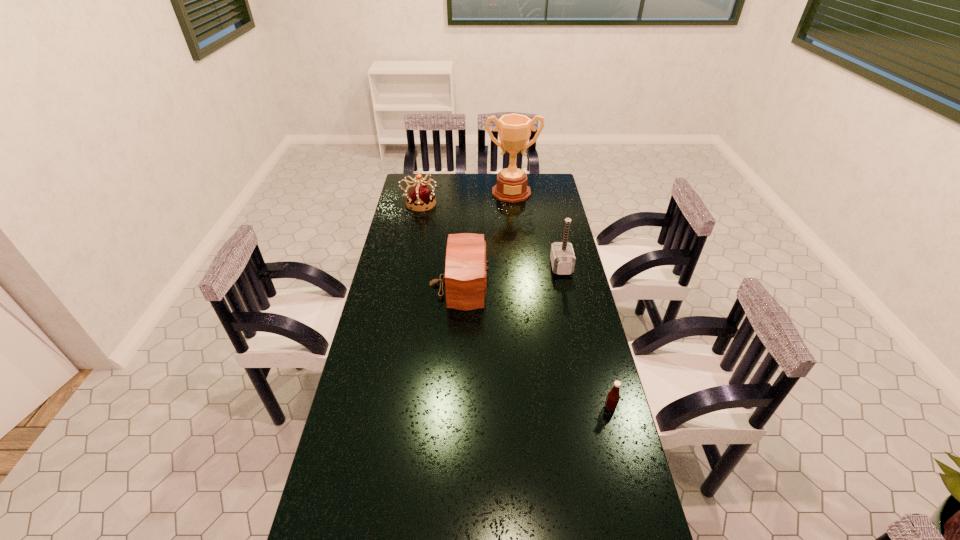
Where is `vacant region located on the front-facing side of the leftmost object`? Image resolution: width=960 pixels, height=540 pixels. vacant region located on the front-facing side of the leftmost object is located at coordinates (449, 204).

You are a GUI agent. You are given a task and a screenshot of the screen. Output one action in this format:
    pyautogui.click(x=<x>, y=<y>)
    Task: Click on the free region located 0.360m on the front-facing side of the radio receiver
    Image resolution: width=960 pixels, height=540 pixels.
    Given the screenshot: What is the action you would take?
    pyautogui.click(x=580, y=285)

You are a GUI agent. You are given a task and a screenshot of the screen. Output one action in this format:
    pyautogui.click(x=<x>, y=<y>)
    Task: Click on the blank area located on the left of the Tabasco sauce
    The height and width of the screenshot is (540, 960).
    Given the screenshot: What is the action you would take?
    pyautogui.click(x=538, y=408)

This screenshot has height=540, width=960. I want to click on award at the far edge, so click(x=514, y=130).

The image size is (960, 540). Find the location of `tiara that is at the far edge`. tiara that is at the far edge is located at coordinates (420, 197).

What are the coordinates of `object at the left edge` in the screenshot? It's located at (420, 197).

Where is `award that is positioned at the right edge`? This screenshot has width=960, height=540. award that is positioned at the right edge is located at coordinates (514, 130).

At what (x,y) coordinates should I click in order to perform the action: click on hammer that is positioned at the right edge. Please return your answer as a coordinate pair (x, y). Looking at the image, I should click on (562, 256).

What are the coordinates of `Tabasco sauce that is at the right edge` in the screenshot? It's located at (613, 396).

Locate an element on the screen. object that is at the far left corner is located at coordinates (420, 197).